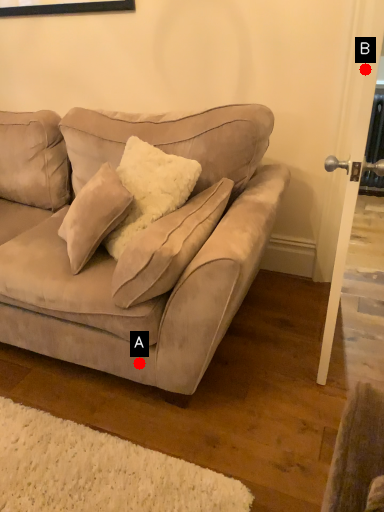
Question: Two points are circled on the image, labeled by A and B beside each circle. Which of the following is the farthest from the observer?

Choices:
 (A) A is further
 (B) B is further

Answer: (B)